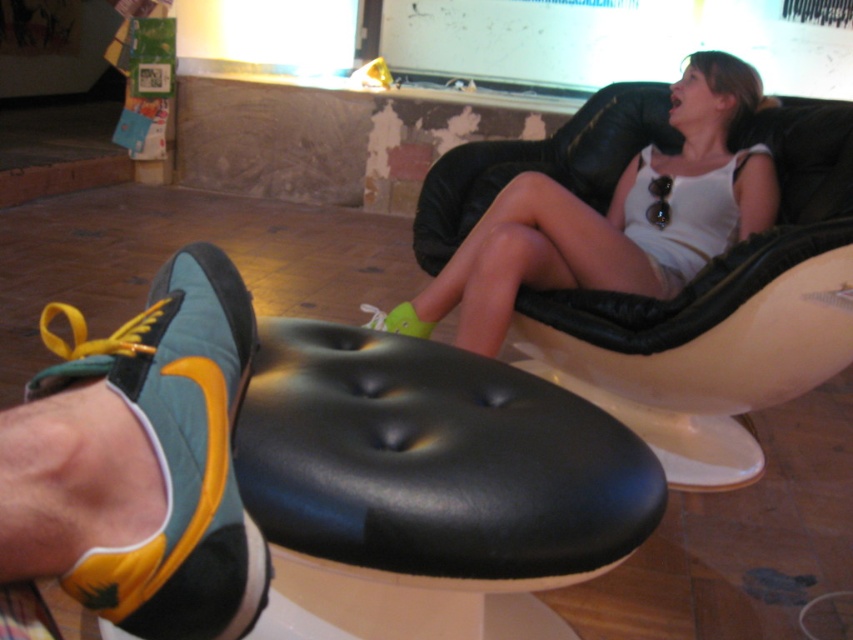
Question: Can you confirm if green suede shoe at lower left is wider than green suede shoe at lower center?

Choices:
 (A) yes
 (B) no

Answer: (B)

Question: Which point is closer to the camera?

Choices:
 (A) (84, 344)
 (B) (389, 323)

Answer: (A)

Question: Can you confirm if green suede shoe at lower left is smaller than white matte tank top at upper center?

Choices:
 (A) yes
 (B) no

Answer: (A)

Question: Based on their relative distances, which object is farther from the green suede shoe at lower center?

Choices:
 (A) white matte tank top at upper center
 (B) black leather footrest at lower center
 (C) green suede shoe at lower left

Answer: (C)

Question: Does green suede shoe at lower left have a smaller size compared to green suede shoe at lower center?

Choices:
 (A) yes
 (B) no

Answer: (B)

Question: Which object is farther from the camera taking this photo?

Choices:
 (A) green suede shoe at lower left
 (B) white matte tank top at upper center
 (C) green suede shoe at lower center

Answer: (C)